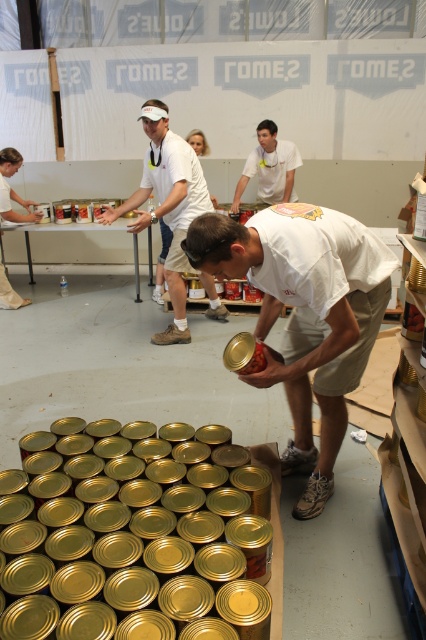
Can you confirm if matte white shirt at center is taller than gold metallic can at center?

Yes.

Does point (344, 224) lie behind point (252, 362)?

No, (344, 224) is in front of (252, 362).

Is point (354, 348) positioned in front of point (255, 362)?

No, (354, 348) is further to viewer.

This screenshot has height=640, width=426. In order to click on matte white shirt at center in this screenshot , I will do `click(305, 316)`.

Who is taller, shiny metallic can at center or gold metallic can at center?

With more height is shiny metallic can at center.

Is point (409, 307) positioned in front of point (259, 352)?

No, it is not.

Find the location of `shiny metallic can at center`. shiny metallic can at center is located at coordinates (411, 321).

Locate an element on the screen. This screenshot has height=640, width=426. shiny metallic can at center is located at coordinates (411, 321).

Who is more forward, [152,182] or [250,365]?

Positioned in front is point [250,365].

Can you confirm if white matte shirt at center is positioned to the right of gold metallic can at center?

In fact, white matte shirt at center is to the left of gold metallic can at center.

Does point (146, 196) come in front of point (256, 355)?

No, (146, 196) is further to viewer.

Locate an element on the screen. The image size is (426, 640). white matte shirt at center is located at coordinates (170, 211).